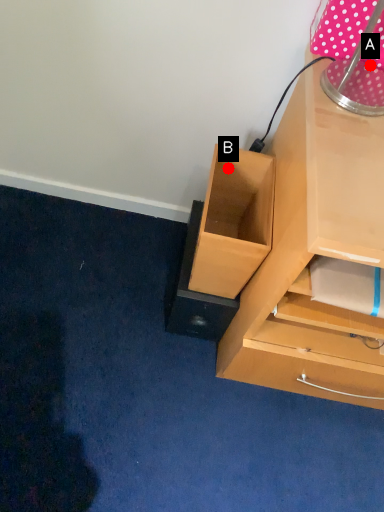
Question: Two points are circled on the image, labeled by A and B beside each circle. Among these points, which one is nearest to the camera?

Choices:
 (A) A is closer
 (B) B is closer

Answer: (A)